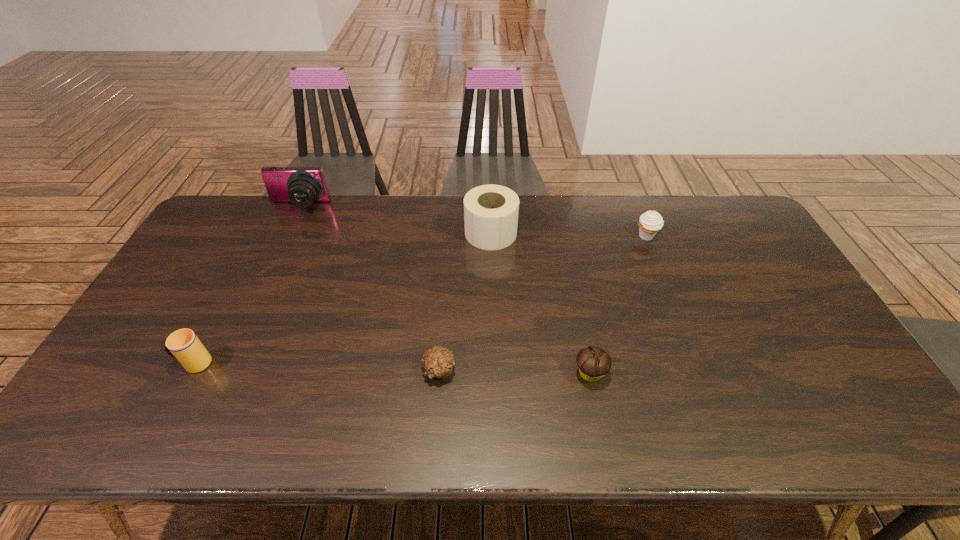
In the image, there is a desktop. Identify the location of vacant space at the near edge. The image size is (960, 540). (260, 416).

In the image, there is a desktop. What are the coordinates of `vacant space at the left edge` in the screenshot? It's located at (164, 359).

Where is `vacant area at the right edge`? The image size is (960, 540). vacant area at the right edge is located at coordinates (761, 298).

Find the location of a particular element. This screenshot has width=960, height=540. empty space between the farthest object and the cup is located at coordinates (247, 285).

Locate an element on the screen. The height and width of the screenshot is (540, 960). unoccupied position between the second shortest muffin and the rightmost muffin is located at coordinates (618, 305).

Locate an element on the screen. Image resolution: width=960 pixels, height=540 pixels. vacant area that lies between the cup and the toilet tissue is located at coordinates (343, 298).

The height and width of the screenshot is (540, 960). I want to click on vacant space that is in between the shortest muffin and the second muffin from right to left, so click(515, 372).

The image size is (960, 540). In order to click on vacant space in between the rightmost muffin and the third object from right to left in this screenshot , I will do `click(568, 234)`.

At what (x,y) coordinates should I click in order to perform the action: click on vacant space in between the camera and the second muffin from left to right. Please return your answer as a coordinate pair (x, y). Looking at the image, I should click on (444, 290).

Locate an element on the screen. This screenshot has width=960, height=540. free space that is in between the cup and the toilet tissue is located at coordinates (343, 298).